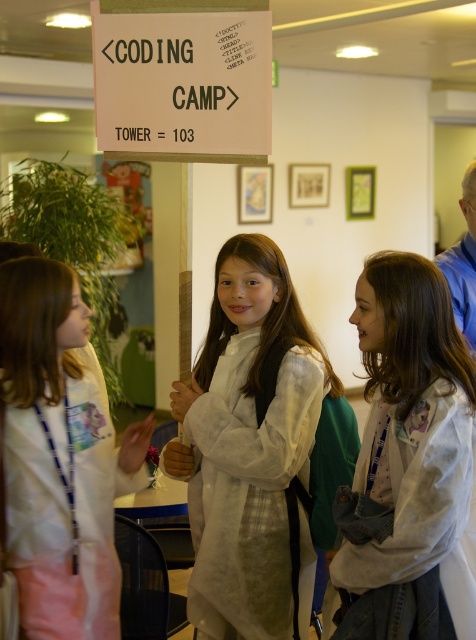
Is white cotton jacket at center smaller than white lab coat at left?

Yes.

Measure the distance between white cotton jacket at center and white lab coat at left.

white cotton jacket at center and white lab coat at left are 34.56 inches apart from each other.

Identify the location of white cotton jacket at center. Image resolution: width=476 pixels, height=640 pixels. (409, 465).

Is white cotton lab coat at center below white paper sign at upper center?

Correct, white cotton lab coat at center is located below white paper sign at upper center.

Identify the location of white cotton lab coat at center. The height and width of the screenshot is (640, 476). (250, 451).

Does white cotton lab coat at center have a lesser width compared to white cotton jacket at center?

No.

Does white cotton lab coat at center lie in front of white cotton jacket at center?

→ No, white cotton lab coat at center is further to the viewer.

Which is in front, point (247, 410) or point (472, 440)?

Point (472, 440)

This screenshot has height=640, width=476. Find the location of `white cotton lab coat at center`. white cotton lab coat at center is located at coordinates (250, 451).